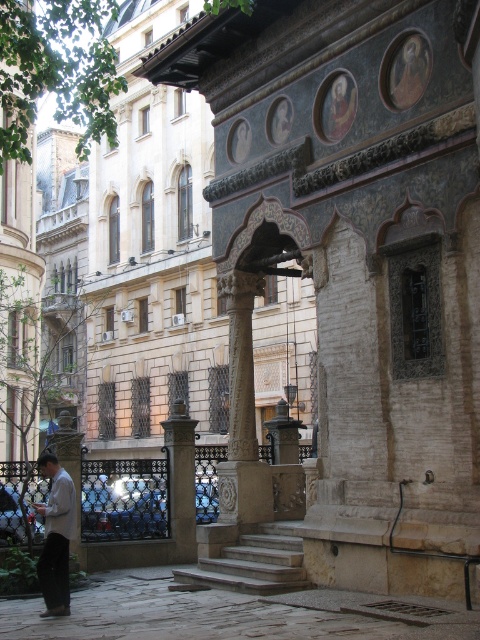
Question: Among these points, which one is nearest to the camera?

Choices:
 (A) (229, 465)
 (B) (184, 547)
 (C) (56, 611)

Answer: (C)

Question: Based on their relative distances, which object is farther from the polished stone column at center?

Choices:
 (A) light brown leather jacket at lower left
 (B) white stone column at center

Answer: (A)

Question: Is white stone column at center to the right of polished stone column at center from the viewer's perspective?

Choices:
 (A) yes
 (B) no

Answer: (A)

Question: Considering the relative positions of light brown leather jacket at lower left and polished stone column at center in the image provided, where is light brown leather jacket at lower left located with respect to polished stone column at center?

Choices:
 (A) below
 (B) above

Answer: (B)

Question: Which is nearer to the polished stone column at center?

Choices:
 (A) white stone column at center
 (B) light brown leather jacket at lower left

Answer: (A)

Question: Does white stone column at center have a greater width compared to light brown leather jacket at lower left?

Choices:
 (A) no
 (B) yes

Answer: (A)